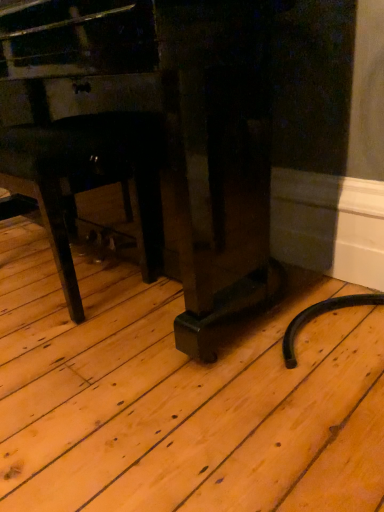
This screenshot has height=512, width=384. Describe the element at coordinates (150, 135) in the screenshot. I see `matte black piano at center, which ranks as the 2th furniture in left-to-right order` at that location.

This screenshot has height=512, width=384. I want to click on matte black piano at center, which ranks as the 2th furniture in left-to-right order, so click(150, 135).

What do you see at coordinates (90, 179) in the screenshot? I see `black matte chair at lower left, acting as the 2th furniture starting from the right` at bounding box center [90, 179].

I want to click on black matte chair at lower left, the first furniture viewed from the left, so click(90, 179).

In order to click on matte black piano at center, which ranks as the 2th furniture in left-to-right order in this screenshot , I will do click(150, 135).

Is matte black piano at center, which ranks as the 2th furniture in left-to-right order, at the left side of black matte chair at lower left, acting as the 2th furniture starting from the right?

Incorrect, matte black piano at center, which ranks as the 2th furniture in left-to-right order, is not on the left side of black matte chair at lower left, acting as the 2th furniture starting from the right.

Between matte black piano at center, arranged as the 1th furniture when viewed from the right, and black matte chair at lower left, acting as the 2th furniture starting from the right, which one is positioned in front?

matte black piano at center, arranged as the 1th furniture when viewed from the right, is in front.

Which is farther from the camera, [209,220] or [110,146]?

Point [110,146]

From the image's perspective, which one is positioned lower, matte black piano at center, arranged as the 1th furniture when viewed from the right, or black matte chair at lower left, the first furniture viewed from the left?

From the image's view, black matte chair at lower left, the first furniture viewed from the left, is below.

From a real-world perspective, is matte black piano at center, arranged as the 1th furniture when viewed from the right, located beneath black matte chair at lower left, acting as the 2th furniture starting from the right?

No, from a real-world perspective, matte black piano at center, arranged as the 1th furniture when viewed from the right, is not under black matte chair at lower left, acting as the 2th furniture starting from the right.

Which of these two, matte black piano at center, which ranks as the 2th furniture in left-to-right order, or black matte chair at lower left, the first furniture viewed from the left, is thinner?

Thinner between the two is black matte chair at lower left, the first furniture viewed from the left.

Considering the sizes of matte black piano at center, which ranks as the 2th furniture in left-to-right order, and black matte chair at lower left, acting as the 2th furniture starting from the right, in the image, is matte black piano at center, which ranks as the 2th furniture in left-to-right order, taller or shorter than black matte chair at lower left, acting as the 2th furniture starting from the right,?

Considering their sizes, matte black piano at center, which ranks as the 2th furniture in left-to-right order, has more height than black matte chair at lower left, acting as the 2th furniture starting from the right.

Between matte black piano at center, arranged as the 1th furniture when viewed from the right, and black matte chair at lower left, acting as the 2th furniture starting from the right, which one has smaller size?

Smaller between the two is black matte chair at lower left, acting as the 2th furniture starting from the right.

Is matte black piano at center, arranged as the 1th furniture when viewed from the right, spatially inside black matte chair at lower left, the first furniture viewed from the left, or outside of it?

matte black piano at center, arranged as the 1th furniture when viewed from the right, is located beyond the bounds of black matte chair at lower left, the first furniture viewed from the left.

Is matte black piano at center, which ranks as the 2th furniture in left-to-right order, beside black matte chair at lower left, the first furniture viewed from the left?

No, matte black piano at center, which ranks as the 2th furniture in left-to-right order, is not in contact with black matte chair at lower left, the first furniture viewed from the left.

Is black matte chair at lower left, the first furniture viewed from the left, at the back of matte black piano at center, arranged as the 1th furniture when viewed from the right?

Yes, matte black piano at center, arranged as the 1th furniture when viewed from the right,'s orientation is away from black matte chair at lower left, the first furniture viewed from the left.

How many degrees apart are the facing directions of matte black piano at center, arranged as the 1th furniture when viewed from the right, and black matte chair at lower left, the first furniture viewed from the left?

matte black piano at center, arranged as the 1th furniture when viewed from the right, and black matte chair at lower left, the first furniture viewed from the left, are facing 0.214 degrees away from each other.

Where is `furniture that is on the left side of matte black piano at center, arranged as the 1th furniture when viewed from the right`? This screenshot has height=512, width=384. furniture that is on the left side of matte black piano at center, arranged as the 1th furniture when viewed from the right is located at coordinates (90, 179).

Based on their positions, is black matte chair at lower left, acting as the 2th furniture starting from the right, located to the left or right of matte black piano at center, which ranks as the 2th furniture in left-to-right order?

Based on their positions, black matte chair at lower left, acting as the 2th furniture starting from the right, is located to the left of matte black piano at center, which ranks as the 2th furniture in left-to-right order.

Which object is closer to the camera taking this photo, black matte chair at lower left, acting as the 2th furniture starting from the right, or matte black piano at center, which ranks as the 2th furniture in left-to-right order?

matte black piano at center, which ranks as the 2th furniture in left-to-right order, is in front.

Considering the points (137, 145) and (190, 268), which point is in front, point (137, 145) or point (190, 268)?

Positioned in front is point (137, 145).

From the image's perspective, is black matte chair at lower left, acting as the 2th furniture starting from the right, located above matte black piano at center, arranged as the 1th furniture when viewed from the right?

No.

From a real-world perspective, which is physically below, black matte chair at lower left, acting as the 2th furniture starting from the right, or matte black piano at center, arranged as the 1th furniture when viewed from the right?

In real-world perspective, black matte chair at lower left, acting as the 2th furniture starting from the right, is lower.

Between black matte chair at lower left, acting as the 2th furniture starting from the right, and matte black piano at center, which ranks as the 2th furniture in left-to-right order, which one has smaller width?

black matte chair at lower left, acting as the 2th furniture starting from the right, is thinner.

Who is shorter, black matte chair at lower left, acting as the 2th furniture starting from the right, or matte black piano at center, which ranks as the 2th furniture in left-to-right order?

With less height is black matte chair at lower left, acting as the 2th furniture starting from the right.

Between black matte chair at lower left, the first furniture viewed from the left, and matte black piano at center, which ranks as the 2th furniture in left-to-right order, which one has larger size?

matte black piano at center, which ranks as the 2th furniture in left-to-right order.

Would you say black matte chair at lower left, acting as the 2th furniture starting from the right, contains matte black piano at center, which ranks as the 2th furniture in left-to-right order?

No, black matte chair at lower left, acting as the 2th furniture starting from the right, does not contain matte black piano at center, which ranks as the 2th furniture in left-to-right order.

Is there a large distance between black matte chair at lower left, acting as the 2th furniture starting from the right, and matte black piano at center, arranged as the 1th furniture when viewed from the right?

No, there isn't a large distance between black matte chair at lower left, acting as the 2th furniture starting from the right, and matte black piano at center, arranged as the 1th furniture when viewed from the right.

Is black matte chair at lower left, acting as the 2th furniture starting from the right, aimed at matte black piano at center, which ranks as the 2th furniture in left-to-right order?

Yes, black matte chair at lower left, acting as the 2th furniture starting from the right, is oriented towards matte black piano at center, which ranks as the 2th furniture in left-to-right order.

What's the angular difference between black matte chair at lower left, acting as the 2th furniture starting from the right, and matte black piano at center, which ranks as the 2th furniture in left-to-right order,'s facing directions?

0.214 degrees.

Where is `furniture behind the matte black piano at center, arranged as the 1th furniture when viewed from the right`? The height and width of the screenshot is (512, 384). furniture behind the matte black piano at center, arranged as the 1th furniture when viewed from the right is located at coordinates (90, 179).

Identify the location of furniture lying on the right of black matte chair at lower left, acting as the 2th furniture starting from the right. The width and height of the screenshot is (384, 512). (150, 135).

Image resolution: width=384 pixels, height=512 pixels. In order to click on furniture that appears below the matte black piano at center, which ranks as the 2th furniture in left-to-right order (from a real-world perspective) in this screenshot , I will do `click(90, 179)`.